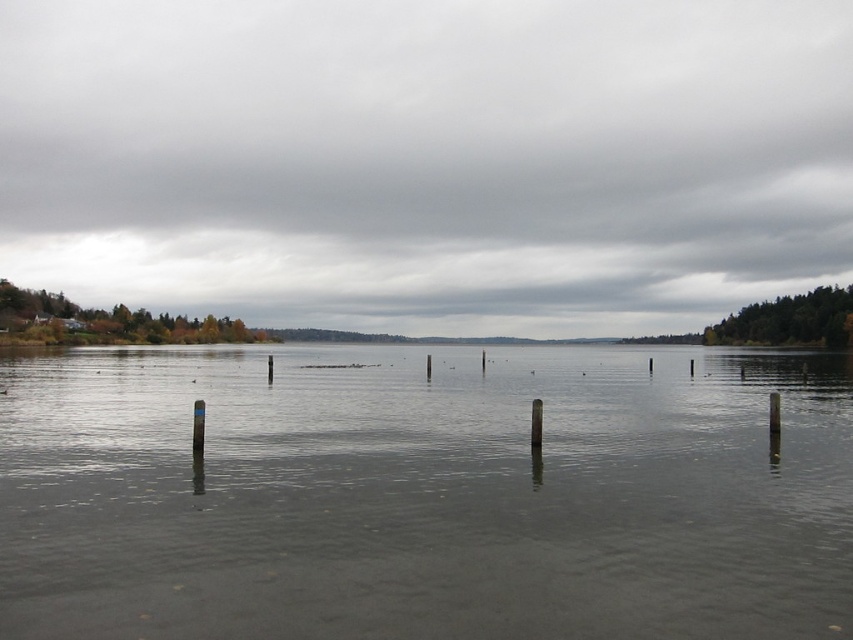
You are standing on the lakeside dock and looking towards the water. Which object, the gray cloudy sky at upper center or the smooth wood post at center, is positioned higher in the scene?

The gray cloudy sky at upper center is positioned higher than the smooth wood post at center in the scene.